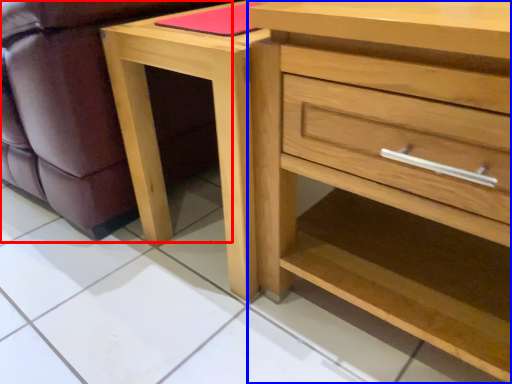
Question: Which object is further to the camera taking this photo, swivel chair (highlighted by a red box) or chest of drawers (highlighted by a blue box)?

Choices:
 (A) swivel chair
 (B) chest of drawers

Answer: (A)